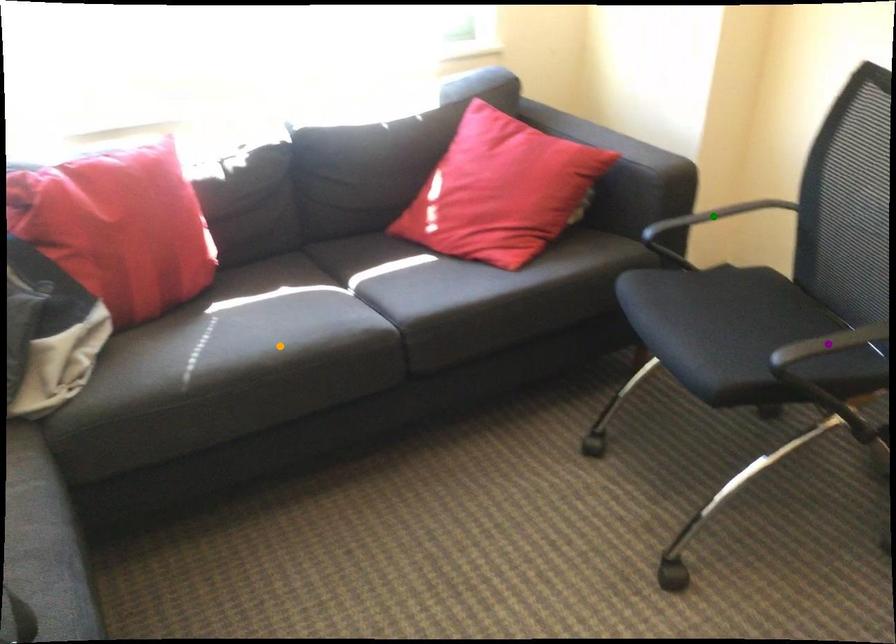
Order these from nearest to farthest:
1. purple point
2. orange point
3. green point

purple point → orange point → green point